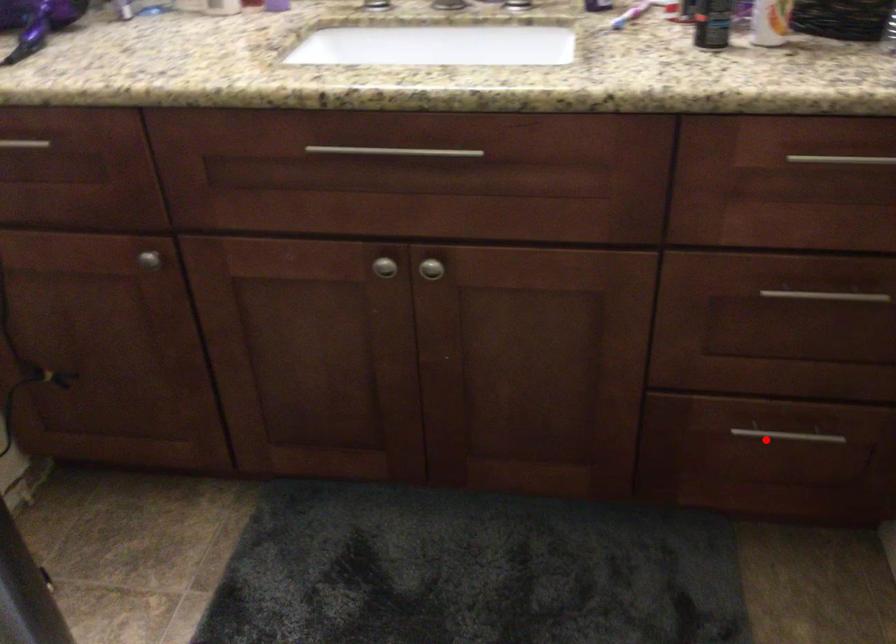
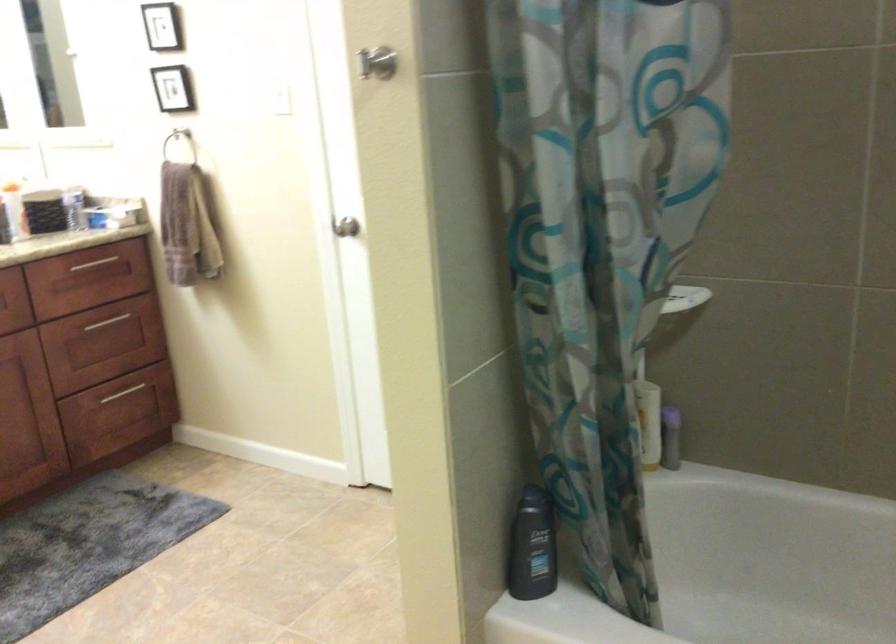
Question: I am providing you with two images of the same scene from different viewpoints. A red point is shown in image1. For the corresponding object point in image2, is it positioned nearer or farther from the camera?

Choices:
 (A) Nearer
 (B) Farther

Answer: (B)